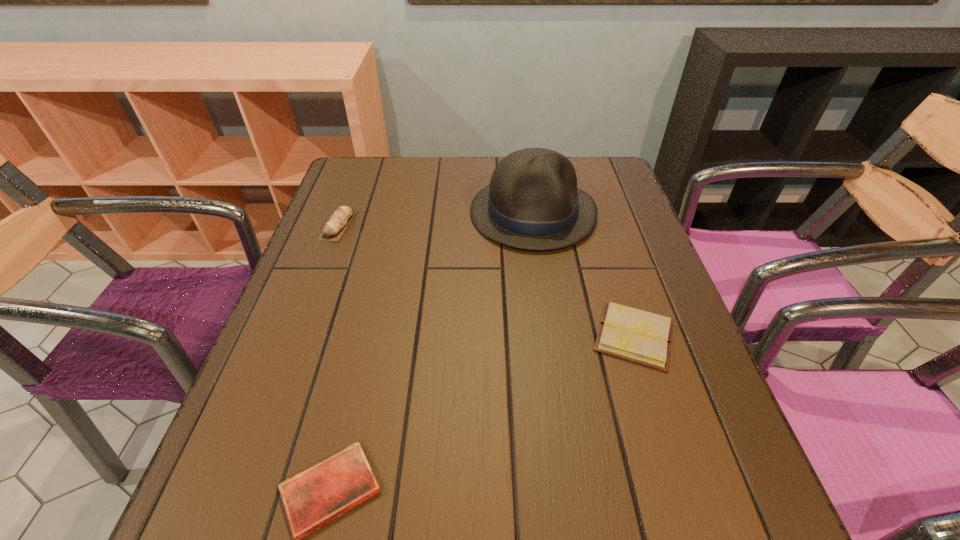
Locate an element on the screen. This screenshot has height=540, width=960. bowler hat that is at the right edge is located at coordinates (532, 202).

Locate an element on the screen. diary that is at the right edge is located at coordinates (635, 335).

Locate an element on the screen. object that is positioned at the far right corner is located at coordinates (532, 202).

Find the location of a particular element. Image resolution: width=960 pixels, height=540 pixels. vacant space at the far edge of the desktop is located at coordinates (464, 200).

Identify the location of blank area at the near edge. The image size is (960, 540). (x=392, y=525).

Where is `vacant space at the left edge of the desktop`? The height and width of the screenshot is (540, 960). vacant space at the left edge of the desktop is located at coordinates (344, 313).

At what (x,y) coordinates should I click in order to perform the action: click on vacant space at the right edge of the desktop. Please return your answer as a coordinate pair (x, y). The height and width of the screenshot is (540, 960). Looking at the image, I should click on (673, 372).

In the image, there is a desktop. Find the location of `vacant space at the far left corner`. vacant space at the far left corner is located at coordinates (340, 192).

Locate an element on the screen. Image resolution: width=960 pixels, height=540 pixels. vacant space at the near left corner of the desktop is located at coordinates (213, 496).

The height and width of the screenshot is (540, 960). Identify the location of free space between the tallest object and the second tallest object. (436, 219).